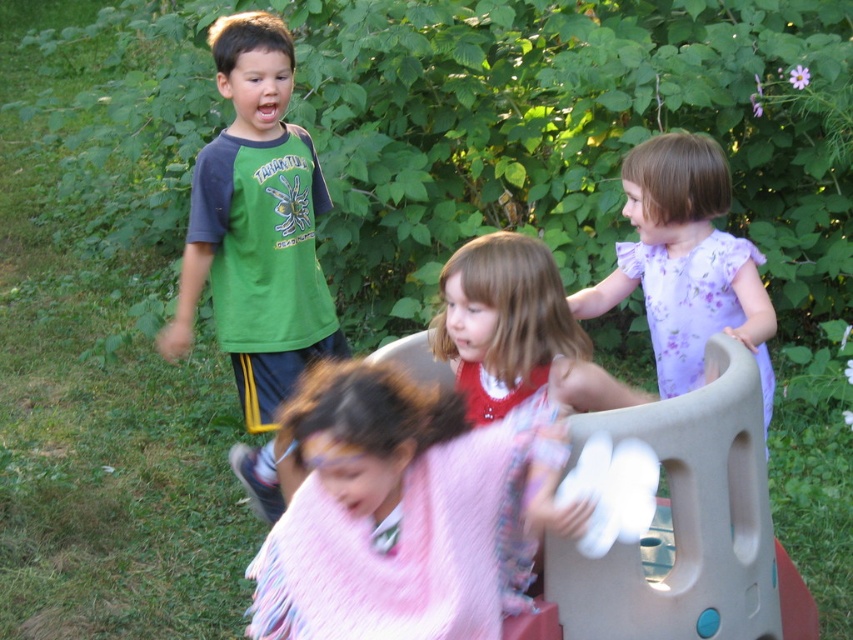
Where is the fuzzy pink blanket at center located in the image?

The fuzzy pink blanket at center is located at point coordinates of 0.800 in the x axis and 0.477 in the y axis.

You are a photographer trying to capture a group photo of the fuzzy pink blanket at center and the purple floral dress at upper right. Since you want both subjects to be clearly visible, which one should you focus on first to ensure it isn

The fuzzy pink blanket at center is not as tall as the purple floral dress at upper right, so you should focus on the purple floral dress at upper right first to ensure it is in clear view before adjusting for the shorter object.

You are trying to decide whether to place a small toy on the fuzzy pink blanket at center or the green raglan shirt at upper left. Which surface has more horizontal space for the toy?

The fuzzy pink blanket at center is wider than the green raglan shirt at upper left, so it has more horizontal space for the toy.